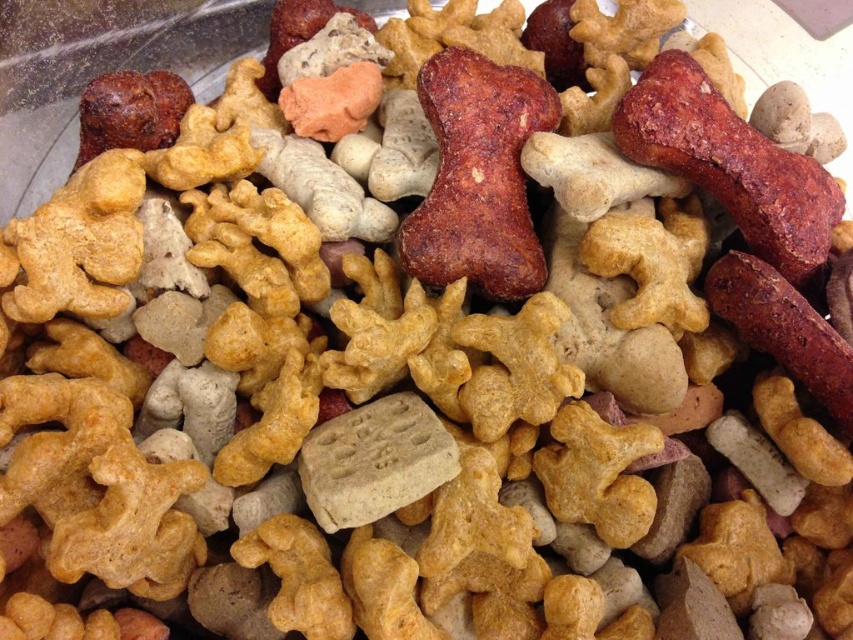
Question: Considering the real-world distances, which object is farthest from the red matte bone at center?

Choices:
 (A) brown crumbly bone at center
 (B) dark brown textured sausage at right

Answer: (A)

Question: Estimate the real-world distances between objects in this image. Which object is farther from the red matte bone at center?

Choices:
 (A) brown crumbly bone at center
 (B) dark brown textured sausage at right

Answer: (A)

Question: Is brown crumbly bone at center to the right of red matte bone at center from the viewer's perspective?

Choices:
 (A) yes
 (B) no

Answer: (B)

Question: Does brown crumbly bone at center appear on the left side of dark brown textured sausage at right?

Choices:
 (A) yes
 (B) no

Answer: (A)

Question: Which point is closer to the camera taking this photo?

Choices:
 (A) (747, 296)
 (B) (509, 99)

Answer: (A)

Question: Does brown crumbly bone at center appear under red matte bone at center?

Choices:
 (A) no
 (B) yes

Answer: (B)